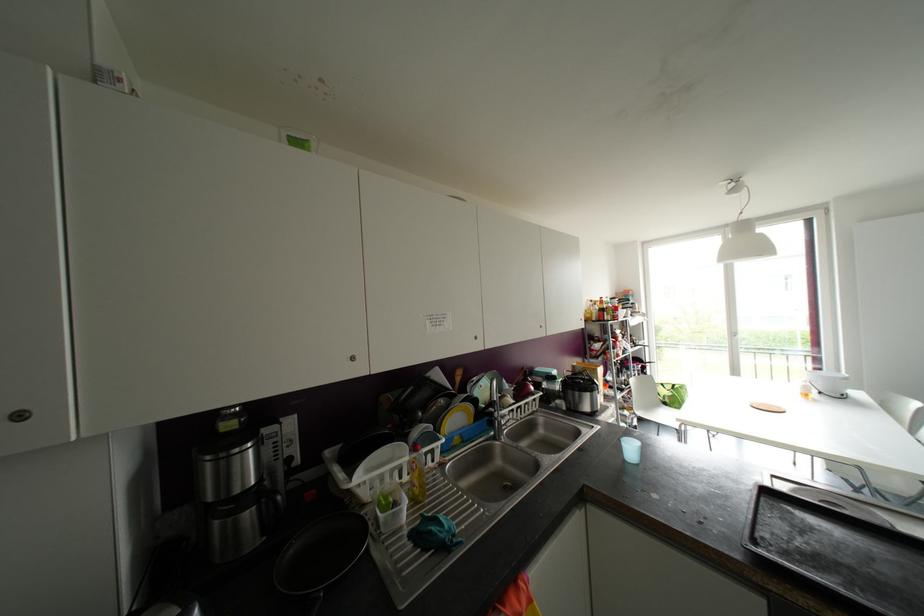
In order to click on faucet handle in this screenshot , I will do `click(500, 424)`.